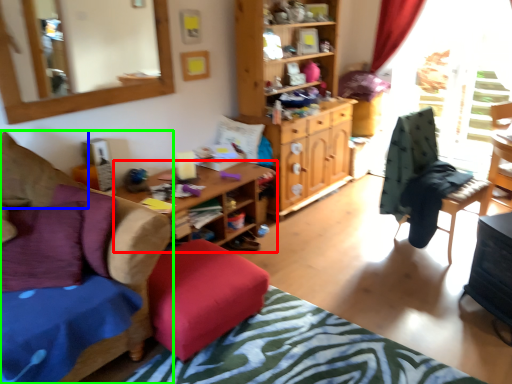
Question: Based on their relative distances, which object is farther from desk (highlighted by a red box)? Choose from pillow (highlighted by a blue box) and chair (highlighted by a green box).

Choices:
 (A) pillow
 (B) chair

Answer: (B)